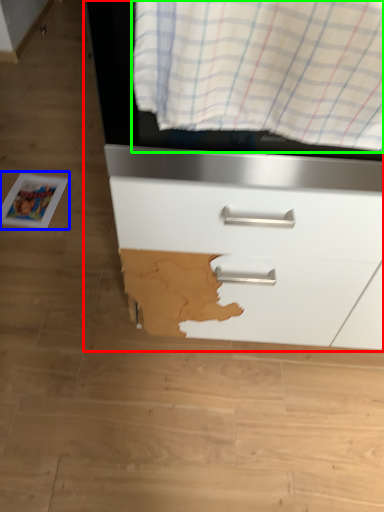
Question: Considering the real-world distances, which object is farthest from chest of drawers (highlighted by a red box)? magazine (highlighted by a blue box) or curtain (highlighted by a green box)?

Choices:
 (A) magazine
 (B) curtain

Answer: (A)